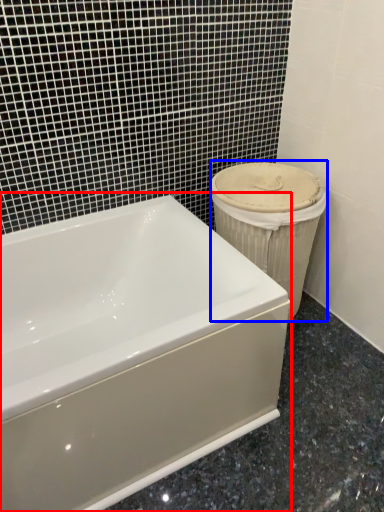
Question: Among these objects, which one is nearest to the camera, bathtub (highlighted by a red box) or porcelain (highlighted by a blue box)?

Choices:
 (A) bathtub
 (B) porcelain

Answer: (A)